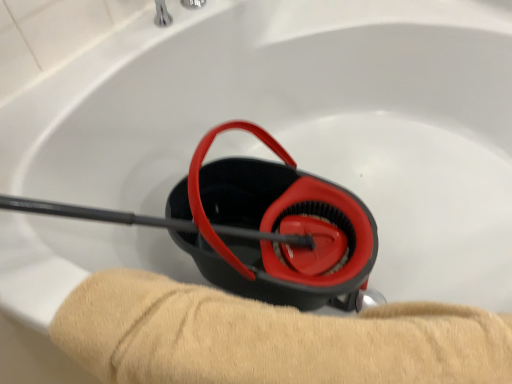
The height and width of the screenshot is (384, 512). What do you see at coordinates (270, 338) in the screenshot? I see `soft beige towel at lower center` at bounding box center [270, 338].

Find the location of a particular element. soft beige towel at lower center is located at coordinates (270, 338).

At what (x,y) coordinates should I click in order to perform the action: click on silver metallic faucet at upper center. Please return your answer as a coordinate pair (x, y). This screenshot has height=384, width=512. Looking at the image, I should click on pyautogui.click(x=162, y=14).

Describe the element at coordinates (162, 14) in the screenshot. Image resolution: width=512 pixels, height=384 pixels. I see `silver metallic faucet at upper center` at that location.

Find the location of a particular element. The height and width of the screenshot is (384, 512). soft beige towel at lower center is located at coordinates (270, 338).

Considering the relative positions of soft beige towel at lower center and silver metallic faucet at upper center in the image provided, is soft beige towel at lower center to the left of silver metallic faucet at upper center from the viewer's perspective?

No.

Is soft beige towel at lower center positioned in front of silver metallic faucet at upper center?

Yes, soft beige towel at lower center is in front of silver metallic faucet at upper center.

Does point (352, 333) come closer to viewer compared to point (155, 0)?

Yes, it is in front of point (155, 0).

From the image's perspective, is soft beige towel at lower center located beneath silver metallic faucet at upper center?

Correct, soft beige towel at lower center appears lower than silver metallic faucet at upper center in the image.

Looking at this image, from a real-world perspective, is soft beige towel at lower center physically above silver metallic faucet at upper center?

Incorrect, from a real-world perspective, soft beige towel at lower center is lower than silver metallic faucet at upper center.

Considering the sizes of soft beige towel at lower center and silver metallic faucet at upper center in the image, is soft beige towel at lower center wider or thinner than silver metallic faucet at upper center?

Clearly, soft beige towel at lower center has more width compared to silver metallic faucet at upper center.

In the scene shown: Who is shorter, soft beige towel at lower center or silver metallic faucet at upper center?

With less height is silver metallic faucet at upper center.

Considering the relative sizes of soft beige towel at lower center and silver metallic faucet at upper center in the image provided, is soft beige towel at lower center smaller than silver metallic faucet at upper center?

Incorrect, soft beige towel at lower center is not smaller in size than silver metallic faucet at upper center.

From the picture: Is soft beige towel at lower center not inside silver metallic faucet at upper center?

soft beige towel at lower center is positioned outside silver metallic faucet at upper center.

Would you consider soft beige towel at lower center to be distant from silver metallic faucet at upper center?

No, soft beige towel at lower center is not far away from silver metallic faucet at upper center.

Is soft beige towel at lower center facing away from silver metallic faucet at upper center?

Correct, soft beige towel at lower center is looking away from silver metallic faucet at upper center.

How many degrees apart are the facing directions of soft beige towel at lower center and silver metallic faucet at upper center?

57.7 degrees separate the facing orientations of soft beige towel at lower center and silver metallic faucet at upper center.

How far apart are soft beige towel at lower center and silver metallic faucet at upper center?

A distance of 30.99 inches exists between soft beige towel at lower center and silver metallic faucet at upper center.

Locate an element on the screen. faucet above the soft beige towel at lower center (from the image's perspective) is located at coordinates (162, 14).

Between silver metallic faucet at upper center and soft beige towel at lower center, which one appears on the right side from the viewer's perspective?

From the viewer's perspective, soft beige towel at lower center appears more on the right side.

Does silver metallic faucet at upper center come in front of soft beige towel at lower center?

No, silver metallic faucet at upper center is behind soft beige towel at lower center.

Does point (167, 10) lie behind point (405, 342)?

Yes, it is.

From the image's perspective, is silver metallic faucet at upper center positioned above or below soft beige towel at lower center?

From the image's perspective, silver metallic faucet at upper center appears above soft beige towel at lower center.

From a real-world perspective, who is located higher, silver metallic faucet at upper center or soft beige towel at lower center?

In real-world perspective, silver metallic faucet at upper center is above.

Looking at their sizes, would you say silver metallic faucet at upper center is wider or thinner than soft beige towel at lower center?

Considering their sizes, silver metallic faucet at upper center looks slimmer than soft beige towel at lower center.

Considering the sizes of objects silver metallic faucet at upper center and soft beige towel at lower center in the image provided, who is taller, silver metallic faucet at upper center or soft beige towel at lower center?

With more height is soft beige towel at lower center.

Is silver metallic faucet at upper center bigger than soft beige towel at lower center?

Incorrect, silver metallic faucet at upper center is not larger than soft beige towel at lower center.

Choose the correct answer: Is silver metallic faucet at upper center inside soft beige towel at lower center or outside it?

silver metallic faucet at upper center is located beyond the bounds of soft beige towel at lower center.

Is silver metallic faucet at upper center not close to soft beige towel at lower center?

No, there isn't a large distance between silver metallic faucet at upper center and soft beige towel at lower center.

Is silver metallic faucet at upper center looking in the opposite direction of soft beige towel at lower center?

No, soft beige towel at lower center is not at the back of silver metallic faucet at upper center.

How many degrees apart are the facing directions of silver metallic faucet at upper center and soft beige towel at lower center?

57.7 degrees.

Identify the location of tan in front of the silver metallic faucet at upper center. Image resolution: width=512 pixels, height=384 pixels. (270, 338).

This screenshot has height=384, width=512. I want to click on tan that is under the silver metallic faucet at upper center (from a real-world perspective), so click(x=270, y=338).

I want to click on tan that is on the right side of silver metallic faucet at upper center, so click(270, 338).